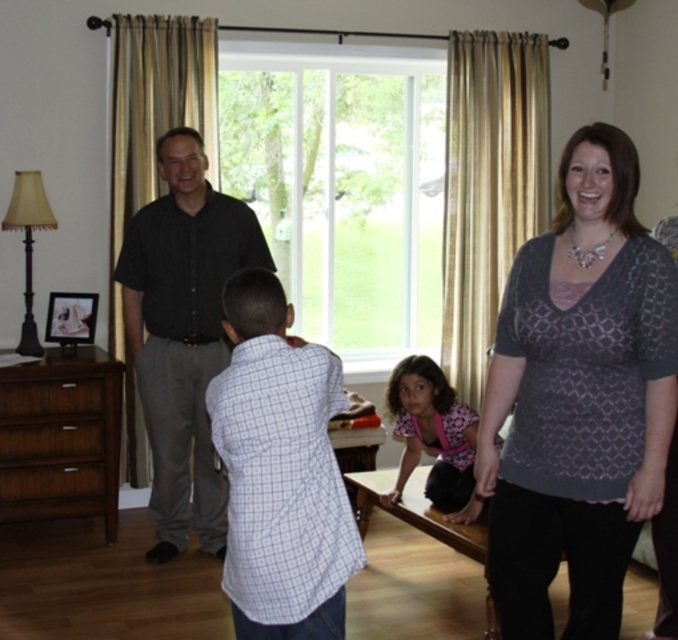
You are a photographer setting up a camera to take a group photo of the two people in the scene. The camera has a minimum focusing distance of 2 meters. Will you need to adjust the camera position to ensure both the patterned gray blouse at right and the black smooth shirt at center are in focus?

The patterned gray blouse at right and the black smooth shirt at center are 1.98 meters apart from each other, which is less than the camera minimum focusing distance of 2 meters. Therefore, you will need to move the camera closer to ensure both are in focus.

You are a photographer setting up a shoot in this living room. You need to ensure that both the patterned gray blouse at right and the black smooth shirt at center are in focus. Which object should you adjust your camera focus to prioritize first to ensure both are sharp?

You should prioritize focusing on the patterned gray blouse at right first because it is closer to the viewer than the black smooth shirt at center. By focusing on the closer object, the farther object will also be in focus due to the depth of field.

You are organizing a small party in the living room and need to place a decorative vase on the brown wood dresser at lower left. However, there is already a black smooth shirt at center on it. Can you place the vase there without moving the shirt?

The black smooth shirt at center is positioned over the brown wood dresser at lower left, so there might not be enough space left on the dresser to place the vase without moving the shirt.